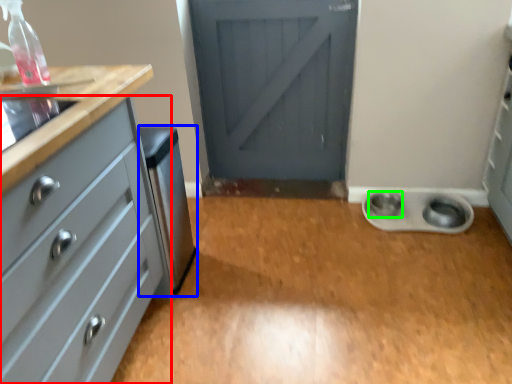
Question: Estimate the real-world distances between objects in this image. Which object is farther from chest of drawers (highlighted by a red box), appliance (highlighted by a blue box) or knob (highlighted by a green box)?

Choices:
 (A) appliance
 (B) knob

Answer: (B)